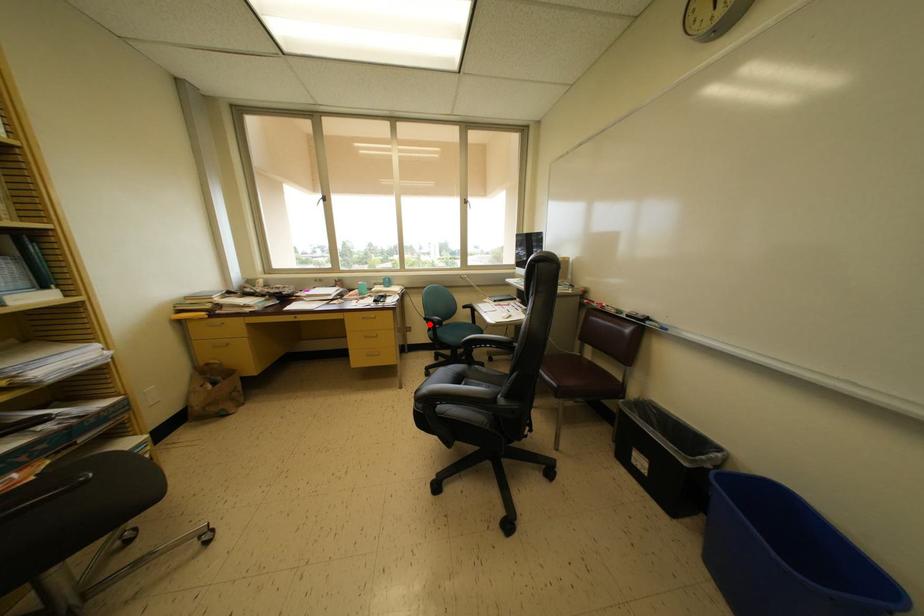
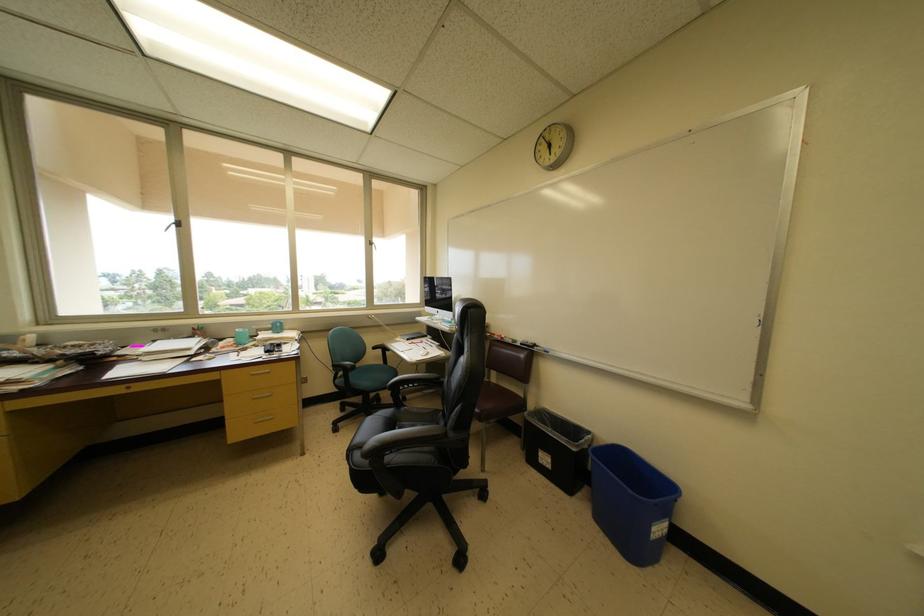
Question: I am providing you with two images of the same scene from different viewpoints. A red point is marked on the first image. Is the red point's position out of view in image 2?

Choices:
 (A) Yes
 (B) No

Answer: (B)